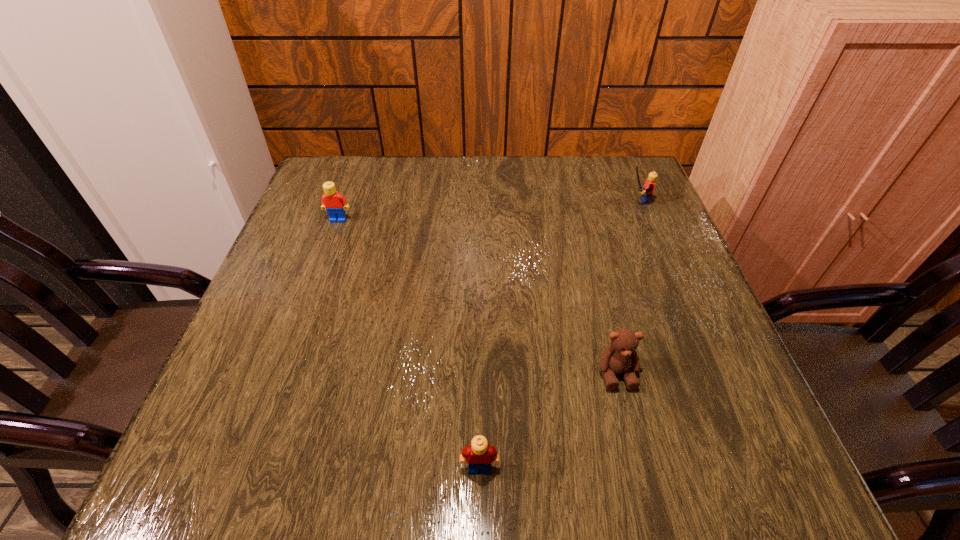
The image size is (960, 540). Identify the location of vacant space at the right edge. (636, 310).

This screenshot has height=540, width=960. In the image, there is a desktop. Find the location of `vacant space at the far left corner`. vacant space at the far left corner is located at coordinates (364, 173).

In the image, there is a desktop. At what (x,y) coordinates should I click in order to perform the action: click on free space at the far right corner. Please return your answer as a coordinate pair (x, y). The height and width of the screenshot is (540, 960). Looking at the image, I should click on (594, 196).

In order to click on free spot at the near right corner of the desktop in this screenshot , I will do (691, 464).

I want to click on vacant space that is in between the farthest object and the third farthest object, so click(x=626, y=287).

At what (x,y) coordinates should I click in order to perform the action: click on vacant point located between the teddy bear and the leftmost object. Please return your answer as a coordinate pair (x, y). Looking at the image, I should click on (477, 296).

At what (x,y) coordinates should I click in order to perform the action: click on empty space between the nearest object and the third nearest object. Please return your answer as a coordinate pair (x, y). Looking at the image, I should click on (409, 343).

The height and width of the screenshot is (540, 960). In order to click on free space between the shortest Lego and the teddy bear in this screenshot , I will do `click(548, 420)`.

The image size is (960, 540). Find the location of `free spot between the third farthest object and the leftmost object`. free spot between the third farthest object and the leftmost object is located at coordinates (477, 296).

The height and width of the screenshot is (540, 960). In order to click on empty space that is in between the leftmost Lego and the nearest Lego in this screenshot , I will do `click(409, 343)`.